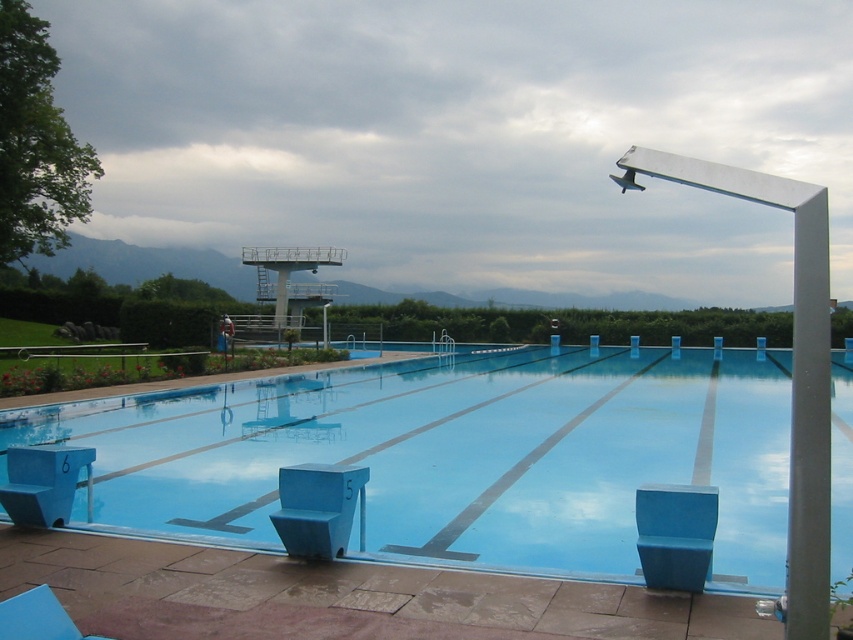
You are a swimmer preparing for a competition and need to choose between the blue smooth diving board at upper center and the blue plastic chair at lower left to rest on. Based on their heights, which one is more suitable for sitting comfortably?

The blue plastic chair at lower left is more suitable for sitting comfortably because the blue smooth diving board at upper center is taller than it, making the chair the appropriate height for a seat.

From the picture: You are a lifeguard who needs to place a new, larger blue plastic chair somewhere on the pool deck. Given the current arrangement of the blue plastic chair at lower center and the blue plastic chair at lower left, which existing chair should you avoid placing the new chair next to to ensure there is enough space?

You should avoid placing the new, larger blue plastic chair next to the blue plastic chair at lower left because it occupies more space than the blue plastic chair at lower center, leaving less room for the new chair.

You are a swimmer preparing for a race and need to choose a seat. You prefer a chair that is wider for better comfort. Which chair should you choose between the blue plastic chair at lower center and the blue plastic chair at lower left?

The blue plastic chair at lower left is wider, so you should choose it for better comfort.